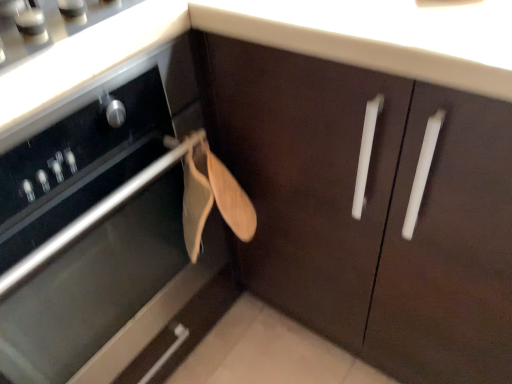
Question: From a real-world perspective, is brown matte cabinet at center beneath satin silver gas stove at upper left?

Choices:
 (A) no
 (B) yes

Answer: (B)

Question: Is brown matte cabinet at center at the left side of satin silver gas stove at upper left?

Choices:
 (A) yes
 (B) no

Answer: (A)

Question: Is brown matte cabinet at center not inside satin silver gas stove at upper left?

Choices:
 (A) no
 (B) yes

Answer: (B)

Question: Is brown matte cabinet at center next to satin silver gas stove at upper left?

Choices:
 (A) no
 (B) yes

Answer: (A)

Question: Is brown matte cabinet at center facing towards satin silver gas stove at upper left?

Choices:
 (A) no
 (B) yes

Answer: (A)

Question: Is brown matte cabinet at center turned away from satin silver gas stove at upper left?

Choices:
 (A) yes
 (B) no

Answer: (B)

Question: Can you confirm if satin silver gas stove at upper left is positioned to the right of brown matte cabinet at center?

Choices:
 (A) no
 (B) yes

Answer: (B)

Question: Does satin silver gas stove at upper left have a smaller size compared to brown matte cabinet at center?

Choices:
 (A) yes
 (B) no

Answer: (A)

Question: Is brown matte cabinet at center completely or partially inside satin silver gas stove at upper left?

Choices:
 (A) yes
 (B) no

Answer: (B)

Question: From the image's perspective, is satin silver gas stove at upper left located beneath brown matte cabinet at center?

Choices:
 (A) yes
 (B) no

Answer: (B)

Question: Is satin silver gas stove at upper left closer to camera compared to brown matte cabinet at center?

Choices:
 (A) yes
 (B) no

Answer: (B)

Question: From a real-world perspective, is satin silver gas stove at upper left physically above brown matte cabinet at center?

Choices:
 (A) yes
 (B) no

Answer: (A)

Question: Considering the positions of satin silver gas stove at upper left and brown matte cabinet at center in the image, is satin silver gas stove at upper left taller or shorter than brown matte cabinet at center?

Choices:
 (A) tall
 (B) short

Answer: (B)